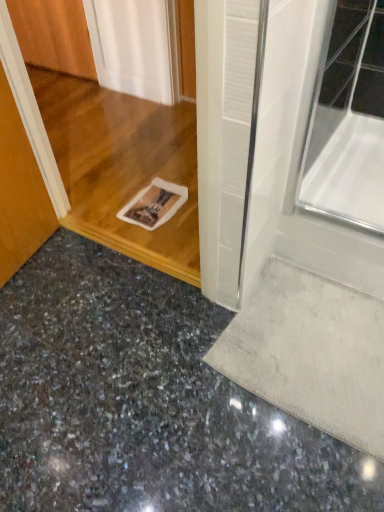
Question: Is polished granite floor at lower left placed right next to white textured mat at lower right?

Choices:
 (A) no
 (B) yes

Answer: (A)

Question: From the image's perspective, is polished granite floor at lower left located beneath white textured mat at lower right?

Choices:
 (A) no
 (B) yes

Answer: (B)

Question: Is polished granite floor at lower left aimed at white textured mat at lower right?

Choices:
 (A) no
 (B) yes

Answer: (B)

Question: Does polished granite floor at lower left have a lesser width compared to white textured mat at lower right?

Choices:
 (A) yes
 (B) no

Answer: (B)

Question: Is polished granite floor at lower left bigger than white textured mat at lower right?

Choices:
 (A) no
 (B) yes

Answer: (B)

Question: Does polished granite floor at lower left contain white textured mat at lower right?

Choices:
 (A) yes
 (B) no

Answer: (B)

Question: Is white textured mat at lower right not near polished granite floor at lower left?

Choices:
 (A) yes
 (B) no

Answer: (B)

Question: From a real-world perspective, does white textured mat at lower right stand above polished granite floor at lower left?

Choices:
 (A) yes
 (B) no

Answer: (A)

Question: Is white textured mat at lower right placed right next to polished granite floor at lower left?

Choices:
 (A) yes
 (B) no

Answer: (B)

Question: From a real-world perspective, is white textured mat at lower right positioned under polished granite floor at lower left based on gravity?

Choices:
 (A) no
 (B) yes

Answer: (A)

Question: Does white textured mat at lower right appear on the right side of polished granite floor at lower left?

Choices:
 (A) yes
 (B) no

Answer: (A)

Question: Can polished granite floor at lower left be found inside white textured mat at lower right?

Choices:
 (A) no
 (B) yes

Answer: (A)

Question: Is point (379, 362) closer or farther from the camera than point (84, 497)?

Choices:
 (A) closer
 (B) farther

Answer: (B)